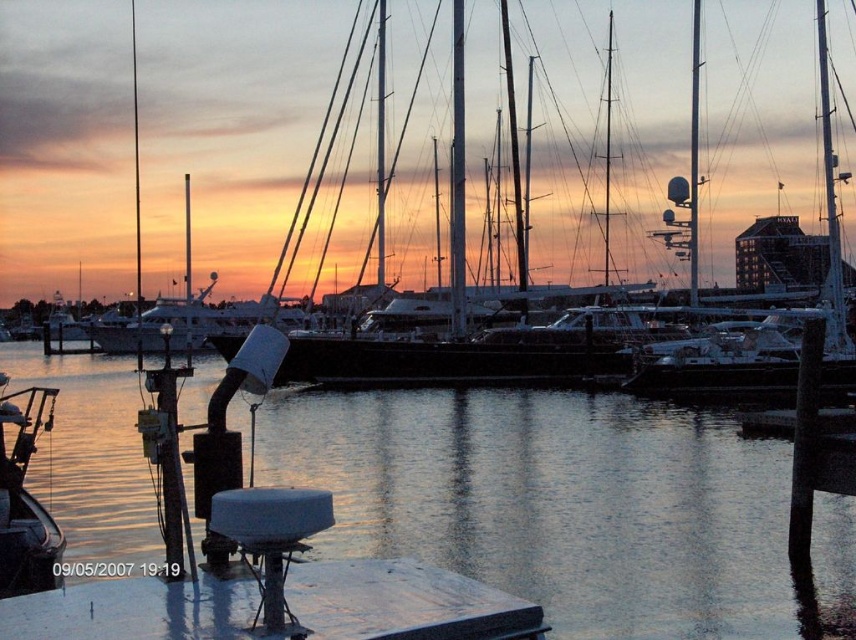
Does metallic gray boat at lower left appear on the left side of shiny silver yacht at center?

In fact, metallic gray boat at lower left is to the right of shiny silver yacht at center.

Is point (27, 540) more distant than point (192, 346)?

That is False.

You are a GUI agent. You are given a task and a screenshot of the screen. Output one action in this format:
    pyautogui.click(x=<x>, y=<y>)
    Task: Click on the metallic gray boat at lower left
    
    Given the screenshot: What is the action you would take?
    pyautogui.click(x=25, y=502)

I want to click on metallic gray boat at lower left, so click(25, 502).

Is point (449, 400) positioned before point (9, 458)?

No, (449, 400) is behind (9, 458).

Describe the element at coordinates (556, 500) in the screenshot. This screenshot has width=856, height=640. I see `silvery reflective water at center` at that location.

Find the location of a particular element. silvery reflective water at center is located at coordinates (556, 500).

Is silvery reflective water at center bigger than metallic silver mast at upper right?

Actually, silvery reflective water at center might be smaller than metallic silver mast at upper right.

Does silvery reflective water at center appear under metallic silver mast at upper right?

Yes.

Is point (96, 392) positioned behind point (696, 96)?

Yes, it is.

Identify the location of silvery reflective water at center. (556, 500).